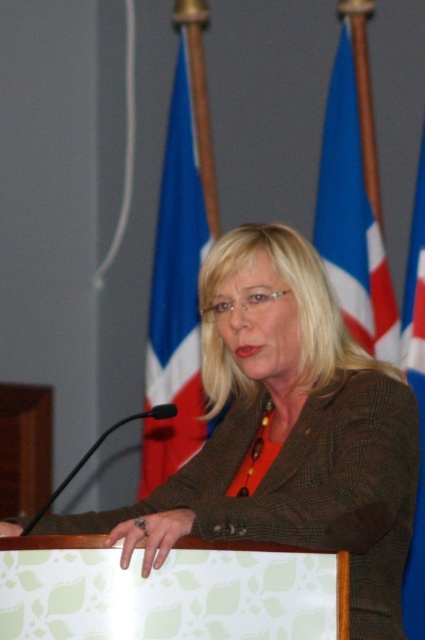
Between point (204, 436) and point (340, 305), which one is positioned in front?

Positioned in front is point (340, 305).

Between blue fabric flag at center and blue fabric flag at upper right, which one appears on the right side from the viewer's perspective?

Positioned to the right is blue fabric flag at upper right.

Which is behind, point (198, 372) or point (368, 320)?

Point (198, 372)

Locate an element on the screen. This screenshot has height=640, width=425. blue fabric flag at center is located at coordinates (180, 272).

Locate an element on the screen. This screenshot has height=640, width=425. brown textured blazer at center is located at coordinates (286, 432).

This screenshot has width=425, height=640. What do you see at coordinates (286, 432) in the screenshot?
I see `brown textured blazer at center` at bounding box center [286, 432].

Locate an element on the screen. brown textured blazer at center is located at coordinates (286, 432).

Between brown textured blazer at center and blue fabric flag at upper right, which one has more height?

blue fabric flag at upper right

Does brown textured blazer at center have a greater width compared to blue fabric flag at upper right?

Yes, brown textured blazer at center is wider than blue fabric flag at upper right.

Which is in front, point (345, 385) or point (317, 227)?

Positioned in front is point (345, 385).

The height and width of the screenshot is (640, 425). Identify the location of brown textured blazer at center. 286,432.